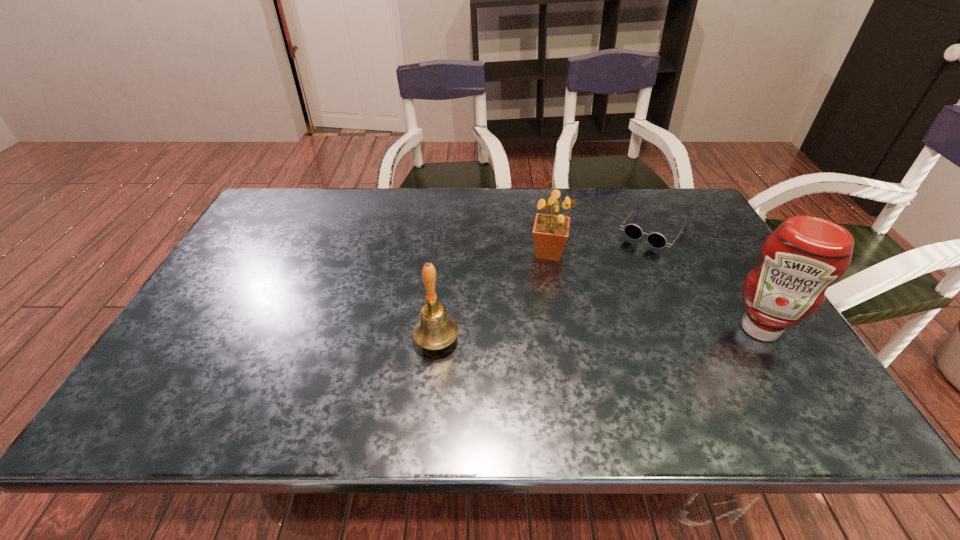
Locate an element on the screen. Image resolution: width=960 pixels, height=540 pixels. blank area located on the front-facing side of the sunglasses is located at coordinates (601, 298).

This screenshot has width=960, height=540. Find the location of `vacant space situated on the front-facing side of the sunglasses`. vacant space situated on the front-facing side of the sunglasses is located at coordinates (615, 279).

Identify the location of object located in the far edge section of the desktop. The image size is (960, 540). (657, 240).

This screenshot has width=960, height=540. I want to click on object located in the near edge section of the desktop, so click(435, 330).

The height and width of the screenshot is (540, 960). I want to click on condiment positioned at the right edge, so click(799, 260).

Image resolution: width=960 pixels, height=540 pixels. In order to click on sunglasses present at the right edge in this screenshot , I will do coord(657,240).

I want to click on object that is at the far right corner, so pos(657,240).

Where is `free space at the far edge`? free space at the far edge is located at coordinates (617, 192).

The image size is (960, 540). In the image, there is a desktop. What are the coordinates of `vacant space at the near edge` in the screenshot? It's located at (696, 359).

Where is `free point at the right edge`? free point at the right edge is located at coordinates (727, 326).